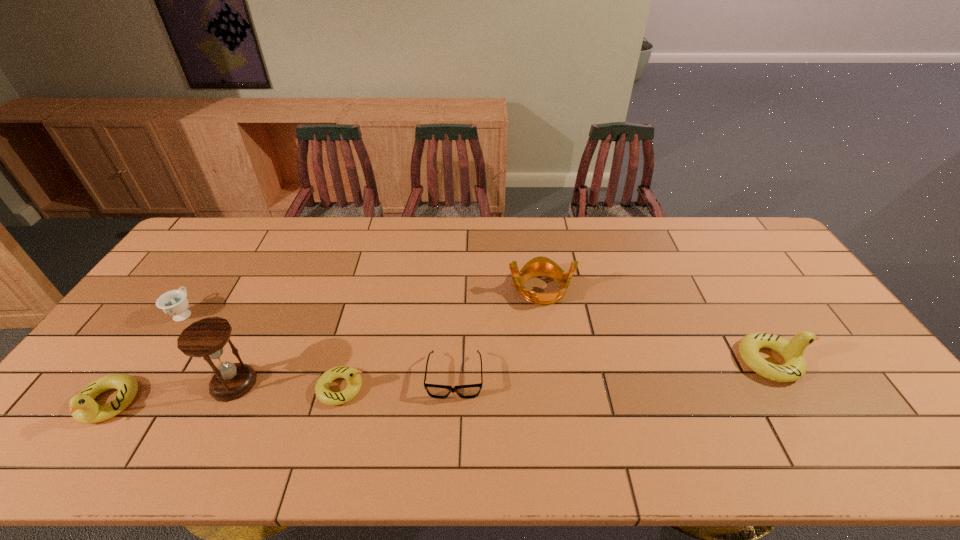
To ensure equal spacing by inserting another duckling among them, please point out a vacant spot for this new duckling. Please provide its 2D coordinates. Your answer should be formatted as a tuple, i.e. [(x, y)], where the tuple contains the x and y coordinates of a point satisfying the conditions above.

[(563, 374)]